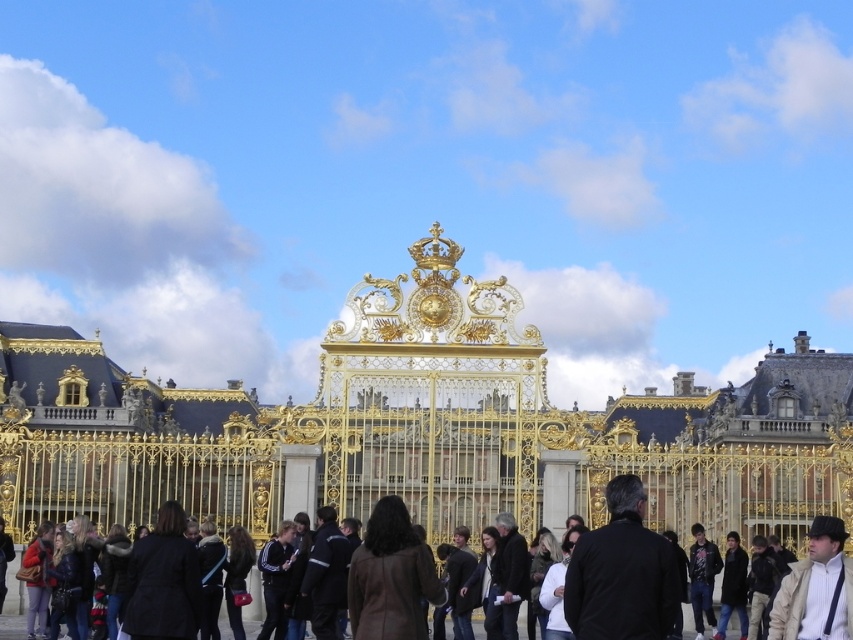
Does matte black jacket at center have a smaller size compared to black leather jacket at center?

Incorrect, matte black jacket at center is not smaller in size than black leather jacket at center.

Can you confirm if matte black jacket at center is positioned below black leather jacket at center?

Yes.

The width and height of the screenshot is (853, 640). What are the coordinates of `matte black jacket at center` in the screenshot? It's located at (276, 579).

Which is more to the right, shiny brown coat at center or white cotton jacket at center?

From the viewer's perspective, white cotton jacket at center appears more on the right side.

Between shiny brown coat at center and white cotton jacket at center, which one is positioned lower?

Positioned lower is white cotton jacket at center.

Who is more forward, (241, 563) or (538, 572)?

Point (538, 572) is in front.

In order to click on shiny brown coat at center in this screenshot , I will do (236, 577).

Who is more distant from viewer, [45,536] or [693,618]?

The point [693,618] is more distant.

Is matte red coat at lower left bigger than dark gray hoodie at center?

Indeed, matte red coat at lower left has a larger size compared to dark gray hoodie at center.

Is point (30, 572) farther from camera compared to point (688, 564)?

No, (30, 572) is closer to viewer.

Identify the location of matte red coat at lower left. (38, 579).